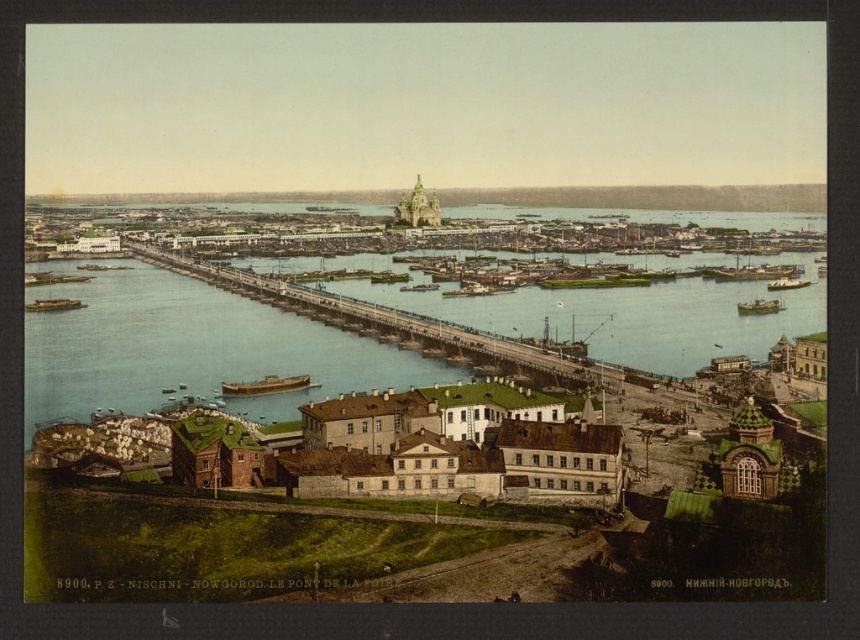
Question: Is blue water at center thinner than metallic gray bridge at center?

Choices:
 (A) no
 (B) yes

Answer: (A)

Question: Estimate the real-world distances between objects in this image. Which object is closer to the wooden ship at lower left?

Choices:
 (A) yellow wooden boat at center
 (B) metallic gray bridge at center
 (C) green matte boat at right

Answer: (B)

Question: Among these objects, which one is farthest from the camera?

Choices:
 (A) green matte boat at right
 (B) blue water at center
 (C) metallic gray bridge at center

Answer: (A)

Question: Does wooden ship at lower left have a larger size compared to green matte boat at right?

Choices:
 (A) no
 (B) yes

Answer: (A)

Question: Which point is closer to the camera?

Choices:
 (A) (407, 296)
 (B) (763, 310)

Answer: (B)

Question: Can you confirm if wooden ship at lower left is thinner than green matte boat at right?

Choices:
 (A) no
 (B) yes

Answer: (B)